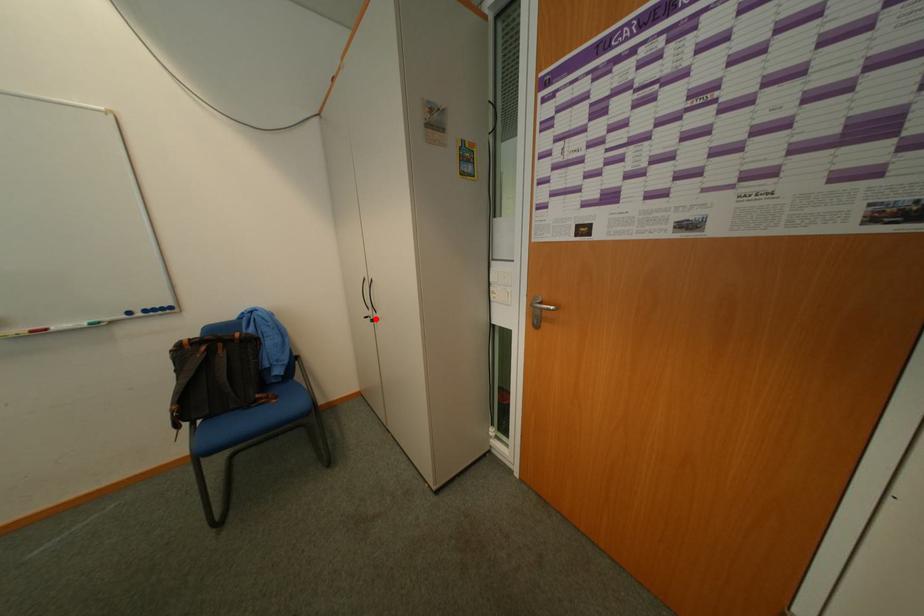
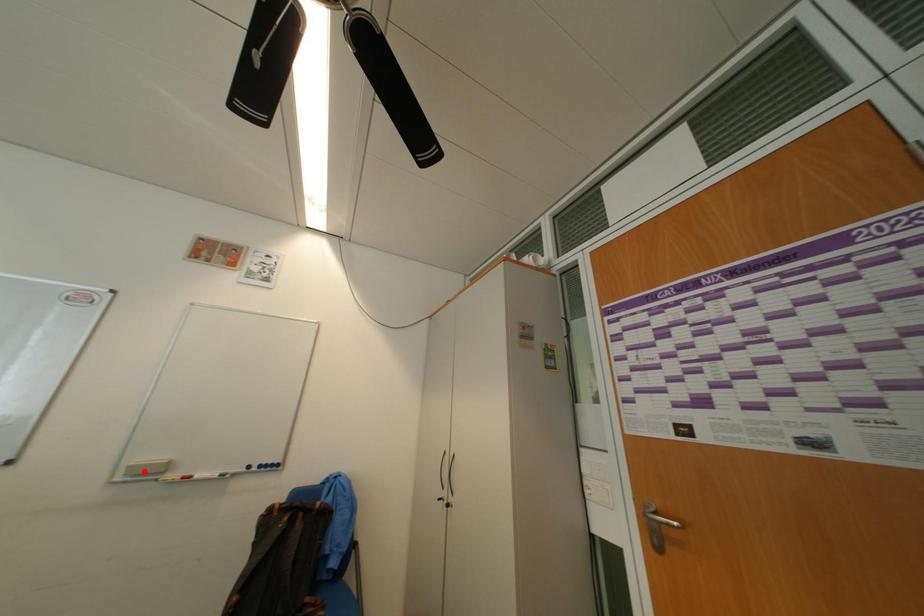
I am providing you with two images of the same scene from different viewpoints. A red point is marked on the first image and another point is marked on the second image. Is the marked point in image1 the same physical position as the marked point in image2?

No